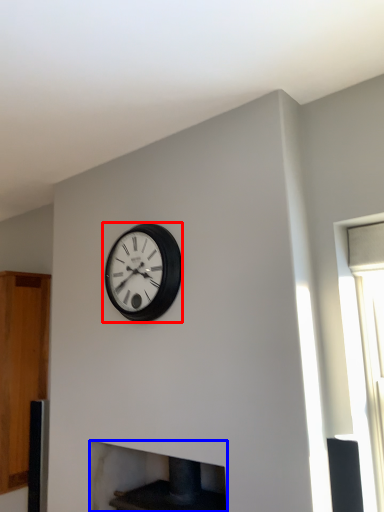
Question: Which point is further to the camera, wall clock (highlighted by a red box) or fireplace (highlighted by a blue box)?

Choices:
 (A) wall clock
 (B) fireplace

Answer: (A)